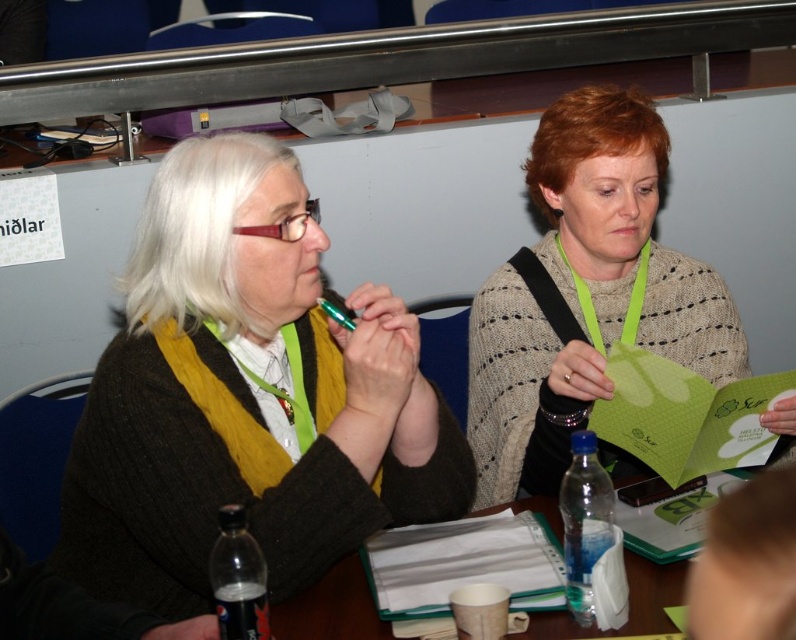
You are sitting at a table with two people. You need to hand a document to the person wearing the matte black sweater at center without disturbing the person in the knitted beige sweater at center. How can you do this?

The matte black sweater at center is in front of the knitted beige sweater at center, so you can approach from the side opposite to the knitted beige sweater at center to hand the document to the matte black sweater at center without disturbing them.

In the scene shown: You are an assistant at a sustainability conference and need to arrange name tags for two attendees. The name tags are placed on their respective sweaters. The matte black sweater at center and the knitted beige sweater at center are both visible from the front. Which sweater will require a taller name tag to fully display the text without being cut off?

The knitted beige sweater at center requires a taller name tag because it has a greater height than the matte black sweater at center, as stated in the description.